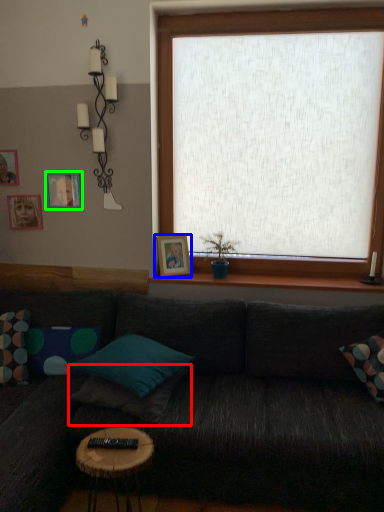
Question: Estimate the real-world distances between objects in this image. Which object is farther from pillow (highlighted by a red box), picture frame (highlighted by a blue box) or picture frame (highlighted by a green box)?

Choices:
 (A) picture frame
 (B) picture frame

Answer: (B)